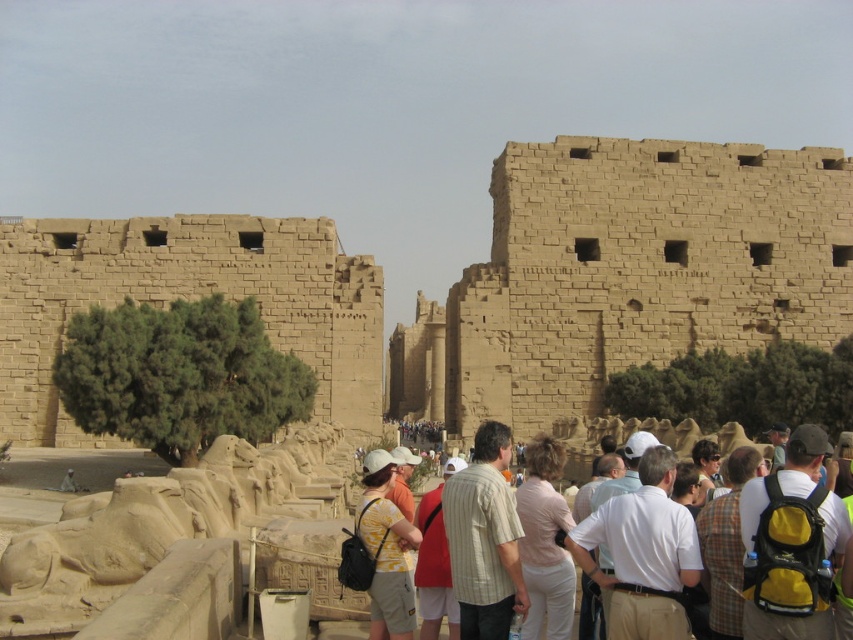
You are an archaeologist standing in front of the brown textured stone wall at left and the yellow printed shirt at center. Which object is taller?

The brown textured stone wall at left is taller than the yellow printed shirt at center.

You are a tourist standing in front of the brown textured stone wall at left and the yellow printed shirt at center. Which object is closer to you?

The brown textured stone wall at left is closer to you than the yellow printed shirt at center.